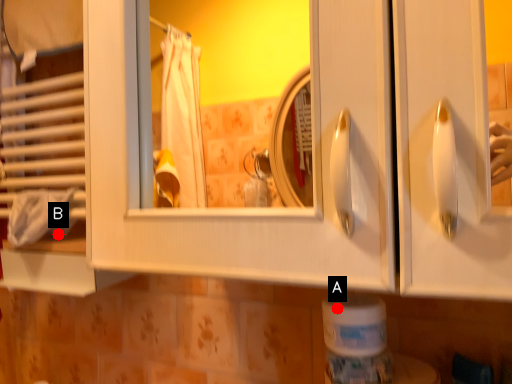
Question: Two points are circled on the image, labeled by A and B beside each circle. Which point is closer to the camera taking this photo?

Choices:
 (A) A is closer
 (B) B is closer

Answer: (A)